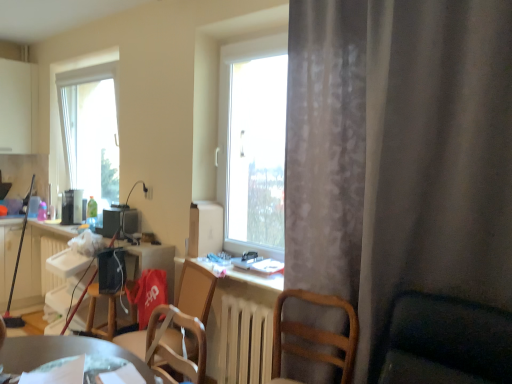
Question: Should I look upward or downward to see matte black speaker at center, the second appliance when ordered from front to back?

Choices:
 (A) up
 (B) down

Answer: (B)

Question: From a real-world perspective, is matte black speaker at center, which appears as the second appliance when viewed from the right, on white plastic radiator at left, which is the 2th radiator in front-to-back order?

Choices:
 (A) no
 (B) yes

Answer: (B)

Question: Can you confirm if matte black speaker at center, the 2th appliance in the left-to-right sequence, is wider than white plastic radiator at left, the first radiator when ordered from back to front?

Choices:
 (A) yes
 (B) no

Answer: (A)

Question: Is matte black speaker at center, which appears as the second appliance when viewed from the right, smaller than white plastic radiator at left, placed as the 2th radiator when sorted from right to left?

Choices:
 (A) no
 (B) yes

Answer: (B)

Question: Can you confirm if matte black speaker at center, the 2th appliance in the left-to-right sequence, is positioned to the right of white plastic radiator at left, which is the 2th radiator in front-to-back order?

Choices:
 (A) yes
 (B) no

Answer: (A)

Question: Is matte black speaker at center, the second appliance when ordered from front to back, next to white plastic radiator at left, the first radiator when ordered from back to front, and touching it?

Choices:
 (A) no
 (B) yes

Answer: (A)

Question: Does matte black speaker at center, the second appliance when ordered from front to back, have a lesser width compared to white plastic radiator at left, which is counted as the first radiator, starting from the left?

Choices:
 (A) yes
 (B) no

Answer: (B)

Question: Does metallic silver desk at lower center have a lesser width compared to white matte radiator at center, the 1th radiator viewed from the right?

Choices:
 (A) yes
 (B) no

Answer: (B)

Question: Is metallic silver desk at lower center not inside white matte radiator at center, the 1th radiator positioned from the front?

Choices:
 (A) no
 (B) yes

Answer: (B)

Question: Is metallic silver desk at lower center positioned in front of white matte radiator at center, the 1th radiator viewed from the right?

Choices:
 (A) no
 (B) yes

Answer: (B)

Question: Can you confirm if metallic silver desk at lower center is wider than white matte radiator at center, which is the second radiator from back to front?

Choices:
 (A) yes
 (B) no

Answer: (A)

Question: From the image's perspective, is metallic silver desk at lower center under white matte radiator at center, which is the second radiator from back to front?

Choices:
 (A) yes
 (B) no

Answer: (B)

Question: Can you confirm if metallic silver desk at lower center is positioned to the left of white matte radiator at center, the 1th radiator viewed from the right?

Choices:
 (A) no
 (B) yes

Answer: (B)

Question: Does gray sheer curtain at right turn towards transparent glass window at left?

Choices:
 (A) yes
 (B) no

Answer: (B)